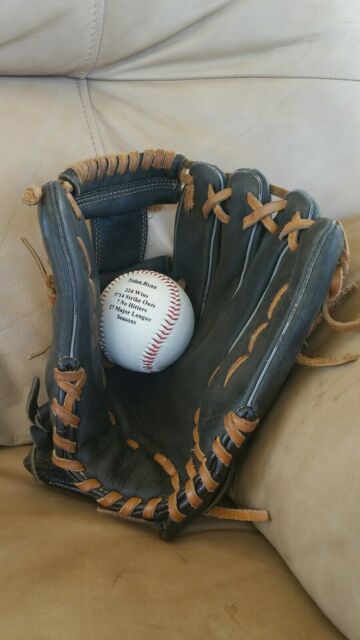
Identify the location of brown suede seat. This screenshot has height=640, width=360. (101, 582).